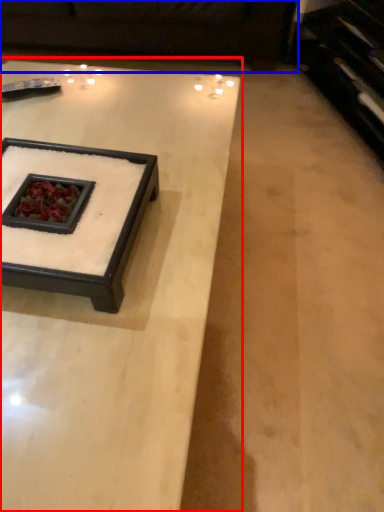
Question: Which object appears farthest to the camera in this image, coffee table (highlighted by a red box) or couch (highlighted by a blue box)?

Choices:
 (A) coffee table
 (B) couch

Answer: (B)